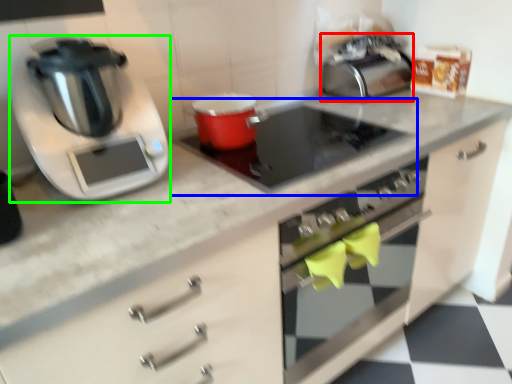
Question: Based on their relative distances, which object is nearer to toaster (highlighted by a red box)? Choose from gas stove (highlighted by a blue box) and kitchen appliance (highlighted by a green box).

Choices:
 (A) gas stove
 (B) kitchen appliance

Answer: (A)